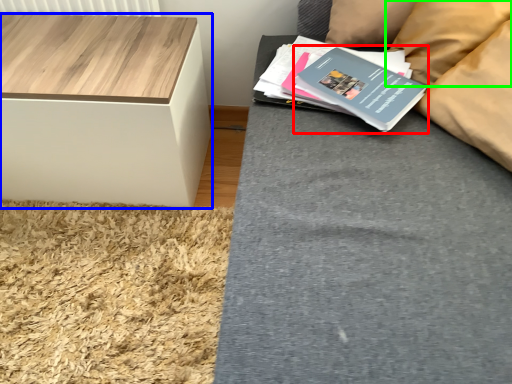
Question: Which object is positioned farthest from paperback book (highlighted by a red box)? Select from table (highlighted by a blue box) and pillow (highlighted by a green box).

Choices:
 (A) table
 (B) pillow

Answer: (A)